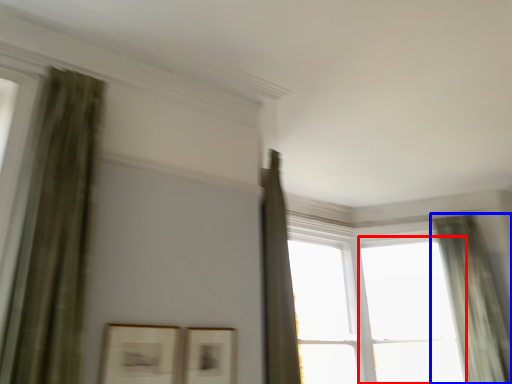
Question: Which object appears closest to the camera in this image, window (highlighted by a red box) or curtain (highlighted by a blue box)?

Choices:
 (A) window
 (B) curtain

Answer: (B)